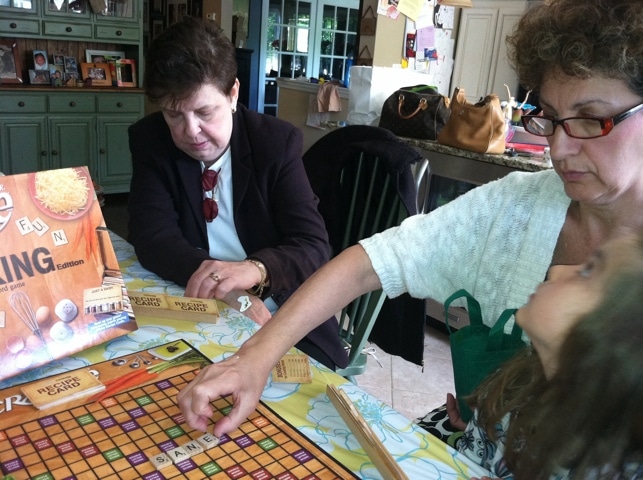
Find the location of `floral print of table cloth`. floral print of table cloth is located at coordinates (317, 413).